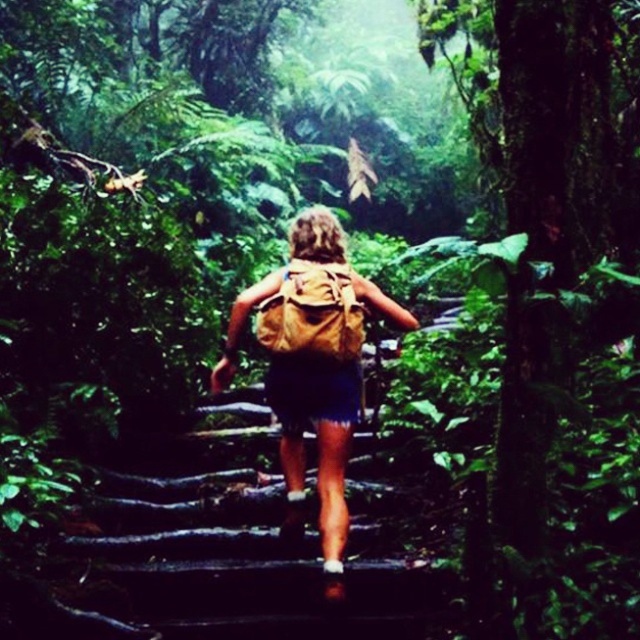
Question: Which object is positioned closest to the brown fabric backpack at center?

Choices:
 (A) wooden steps at center
 (B) brown canvas backpack at center

Answer: (B)

Question: Does wooden steps at center have a greater width compared to brown fabric backpack at center?

Choices:
 (A) yes
 (B) no

Answer: (A)

Question: Which of the following is the closest to the observer?

Choices:
 (A) (168, 634)
 (B) (333, 499)
 (C) (292, 276)

Answer: (A)

Question: Among these points, which one is farthest from the camera?

Choices:
 (A) (348, 378)
 (B) (273, 344)

Answer: (A)

Question: Is the position of wooden steps at center less distant than that of brown canvas backpack at center?

Choices:
 (A) yes
 (B) no

Answer: (A)

Question: Is wooden steps at center thinner than brown canvas backpack at center?

Choices:
 (A) no
 (B) yes

Answer: (A)